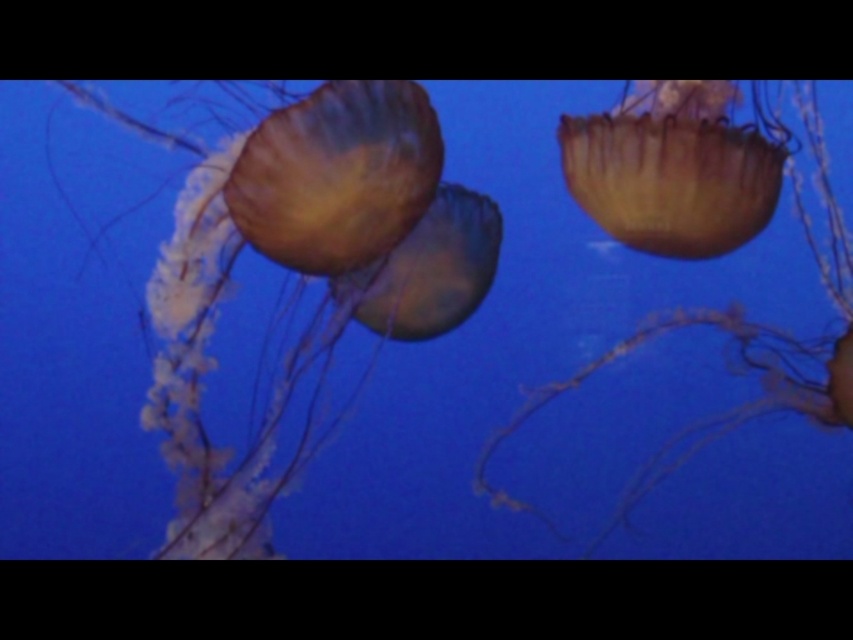
Can you confirm if translucent yellowish jellyfish at center is smaller than translucent yellow jellyfish at center?

No, translucent yellowish jellyfish at center is not smaller than translucent yellow jellyfish at center.

Is point (773, 356) positioned in front of point (735, 218)?

No.

Locate an element on the screen. Image resolution: width=853 pixels, height=640 pixels. translucent yellowish jellyfish at center is located at coordinates [x=704, y=308].

Who is higher up, translucent gelatinous at left or translucent yellow jellyfish at center?

translucent yellow jellyfish at center is above.

Is point (199, 224) more distant than point (590, 115)?

No, it is not.

At what (x,y) coordinates should I click in order to perform the action: click on translucent gelatinous at left. Please return your answer as a coordinate pair (x, y). The width and height of the screenshot is (853, 640). Looking at the image, I should click on (279, 264).

Looking at this image, which is more to the left, translucent gelatinous at left or translucent yellowish jellyfish at center?

translucent gelatinous at left

Does translucent gelatinous at left appear under translucent yellowish jellyfish at center?

No.

This screenshot has width=853, height=640. What are the coordinates of `translucent gelatinous at left` in the screenshot? It's located at coord(279,264).